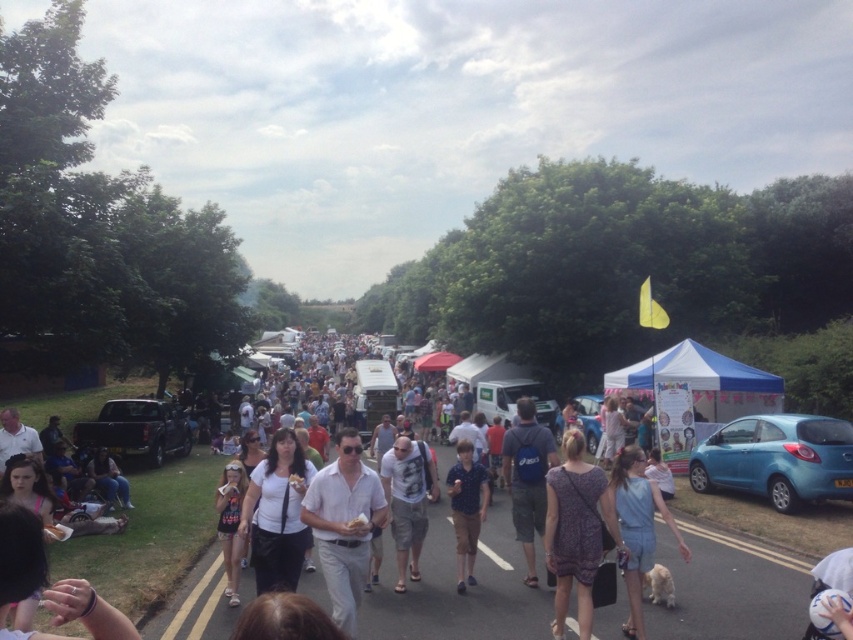
You are a photographer trying to capture a photo of the lively outdoor event. You notice the matte white dress at center and the white matte van at center. Which object should you focus on to ensure it stands out more in your photo due to its height?

The matte white dress at center is much taller than the white matte van at center, so focusing on the matte white dress at center will make it stand out more due to its height.

You are a pedestrian standing at the left side of the road where the grassy area is. You need to cross the road to reach the parked black pickup truck on the right. However, there are two cars blocking your path. The first is the blue metallic car at center, and the second is the matte blue hatchback at right. Which car do you need to wait for first before proceeding safely?

You need to wait for the matte blue hatchback at right first because it is positioned over the blue metallic car at center, meaning it is closer to you and blocking the path more directly.